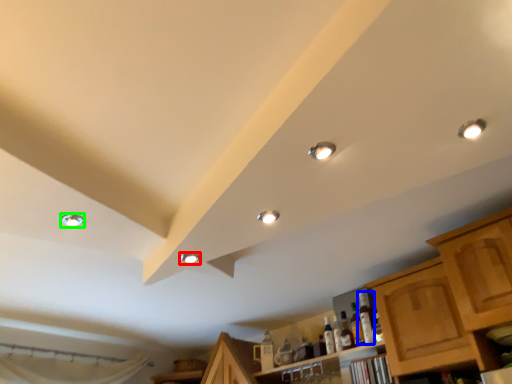
Question: Which object is positioned closest to droplight (highlighted by a red box)? Select from bottle (highlighted by a blue box) and droplight (highlighted by a green box).

Choices:
 (A) bottle
 (B) droplight

Answer: (B)